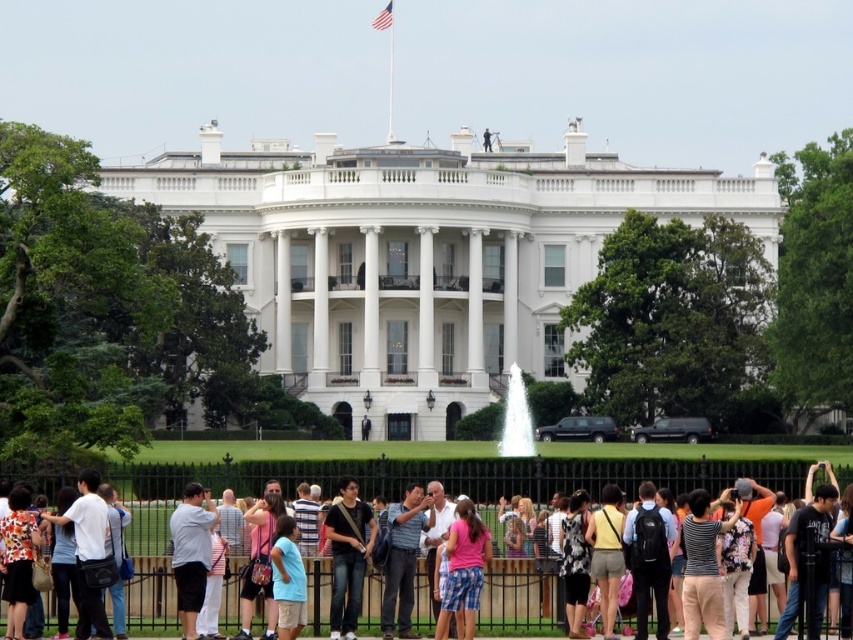
Can you confirm if black cotton t-shirt at center is positioned to the left of striped shirt at center?

Indeed, black cotton t-shirt at center is positioned on the left side of striped shirt at center.

Does black cotton t-shirt at center appear on the right side of striped shirt at center?

In fact, black cotton t-shirt at center is to the left of striped shirt at center.

Between point (335, 568) and point (387, 513), which one is positioned in front?

Point (335, 568)

Where is `black cotton t-shirt at center`? Image resolution: width=853 pixels, height=640 pixels. black cotton t-shirt at center is located at coordinates (347, 556).

Is pink cotton shirt at center below white glossy water at center?

Yes, pink cotton shirt at center is below white glossy water at center.

Does pink cotton shirt at center lie in front of white glossy water at center?

Yes, pink cotton shirt at center is closer to the viewer.

The width and height of the screenshot is (853, 640). Find the location of `pink cotton shirt at center`. pink cotton shirt at center is located at coordinates (463, 566).

Can you confirm if black cotton t-shirt at center is positioned to the left of pink cotton shirt at center?

Correct, you'll find black cotton t-shirt at center to the left of pink cotton shirt at center.

Can you confirm if black cotton t-shirt at center is shorter than pink cotton shirt at center?

Yes.

Locate an element on the screen. The width and height of the screenshot is (853, 640). black cotton t-shirt at center is located at coordinates (347, 556).